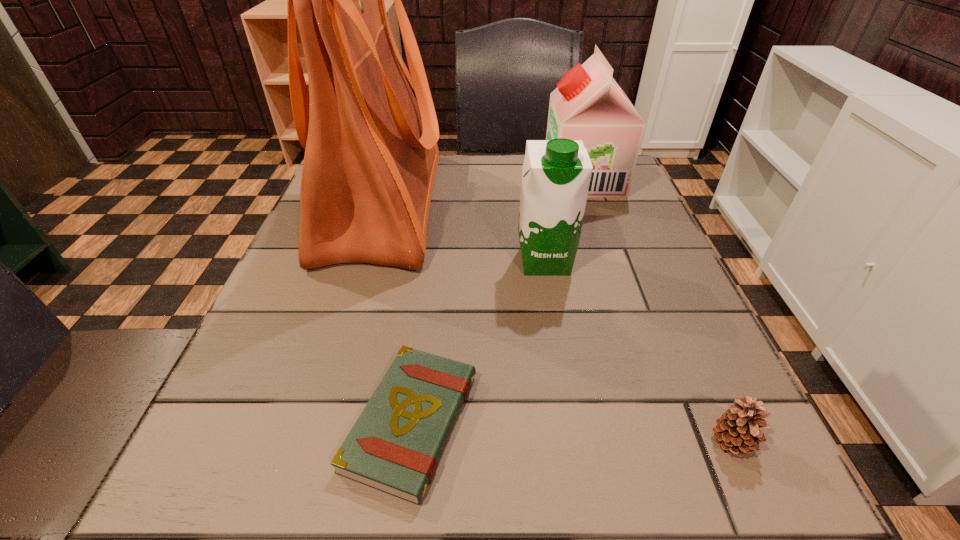
Locate an element on the screen. The image size is (960, 540). object located at the far right corner is located at coordinates (588, 104).

Find the location of a particular element. The width and height of the screenshot is (960, 540). object that is at the near right corner is located at coordinates (737, 429).

In the image, there is a desktop. Where is `vacant space at the far edge`? vacant space at the far edge is located at coordinates (455, 181).

You are a GUI agent. You are given a task and a screenshot of the screen. Output one action in this format:
    pyautogui.click(x=<x>, y=<y>)
    Task: Click on the vacant space at the near edge of the desktop
    
    Given the screenshot: What is the action you would take?
    pyautogui.click(x=520, y=468)

The width and height of the screenshot is (960, 540). I want to click on vacant space at the left edge, so click(288, 268).

Where is `vacant space at the right edge of the desktop`? The width and height of the screenshot is (960, 540). vacant space at the right edge of the desktop is located at coordinates click(636, 344).

The height and width of the screenshot is (540, 960). In order to click on vacant space at the near right corner of the desktop in this screenshot , I will do `click(760, 469)`.

You are a GUI agent. You are given a task and a screenshot of the screen. Output one action in this format:
    pyautogui.click(x=<x>, y=<y>)
    Task: Click on the empty space between the second shortest object and the farther soya milk
    The width and height of the screenshot is (960, 540).
    Given the screenshot: What is the action you would take?
    pyautogui.click(x=658, y=311)

Identify the location of free spot between the book and the second shortest object. This screenshot has width=960, height=540. (572, 433).

Find the location of a particular element. The image size is (960, 540). free space between the pinecone and the nearer soya milk is located at coordinates (638, 352).